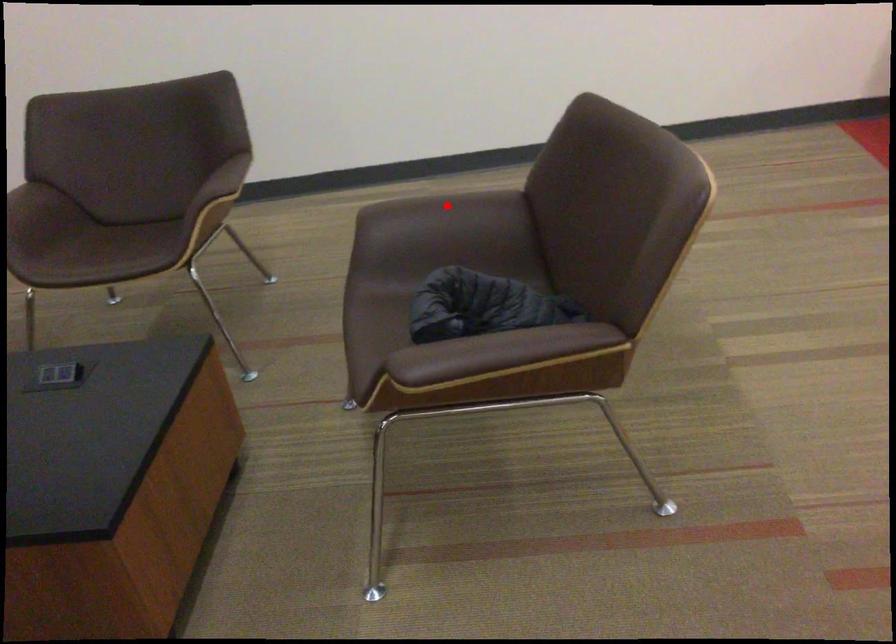
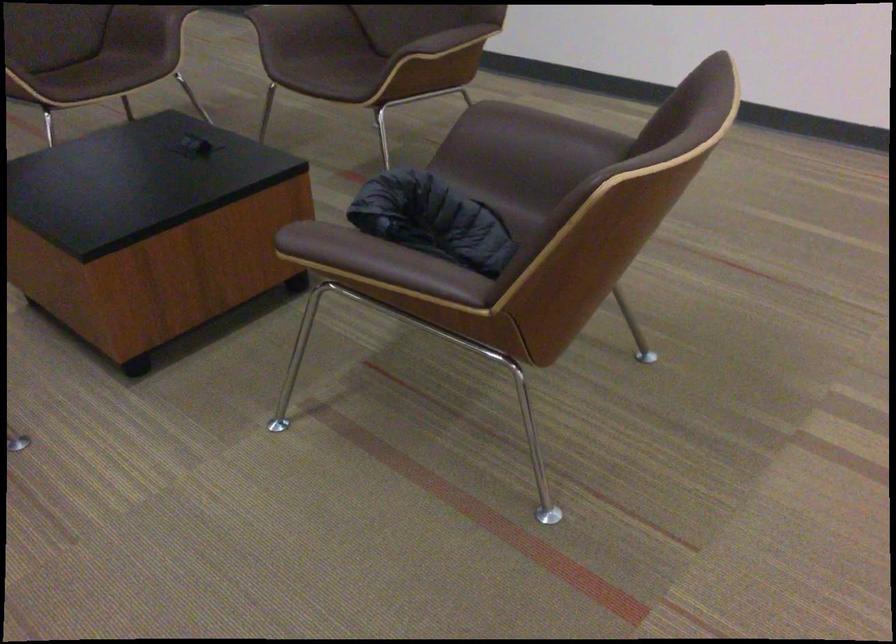
Where in the second image is the point corresponding to the highlighted location from the first image?

(545, 128)